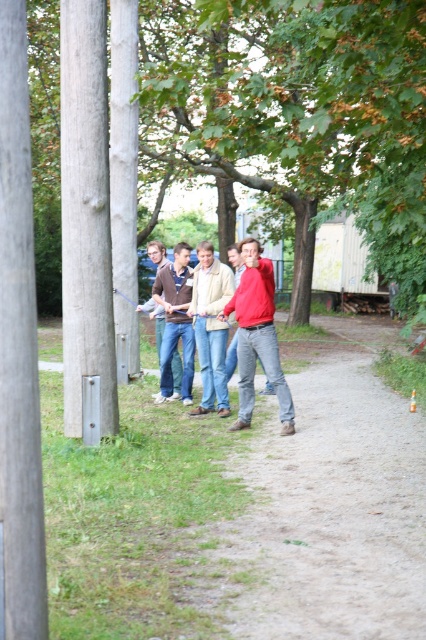
You are planning to walk along the dirt path at center while avoiding the green leafy tree at center. Is there enough space between them to walk safely?

The green leafy tree at center and dirt path at center are 18.79 feet apart, so yes, there is enough space to walk safely between them.

You are a photographer trying to capture a group photo of the matte brown shirt at center and the matte red hoodie at center. Which person should you position closer to the camera to ensure both are in focus?

The matte brown shirt at center is much taller than the matte red hoodie at center, so positioning the matte red hoodie at center closer to the camera will help ensure both are in focus.